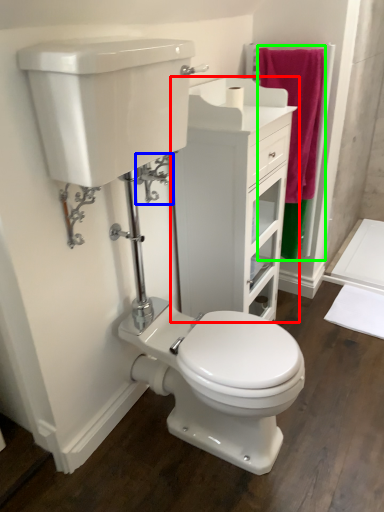
Question: Which object is the farthest from bathroom cabinet (highlighted by a red box)? Choose among these: plumbing fixture (highlighted by a blue box) or bath towel (highlighted by a green box).

Choices:
 (A) plumbing fixture
 (B) bath towel

Answer: (A)